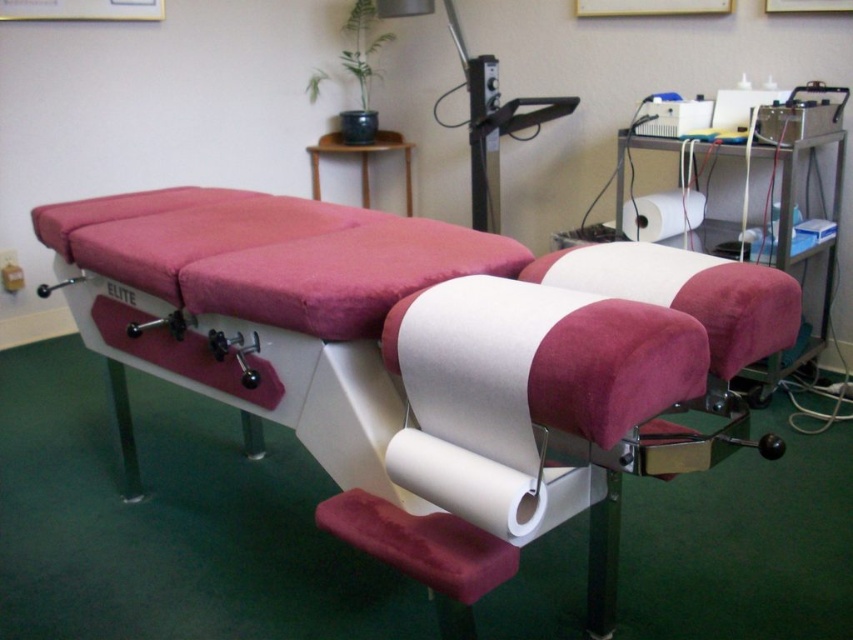
Question: Is white matte toilet paper at lower center thinner than white paper towel at center?

Choices:
 (A) yes
 (B) no

Answer: (B)

Question: Which of these objects is positioned closest to the velvet-like pink hospital bed at center?

Choices:
 (A) velvet-like burgundy stool at lower center
 (B) white matte toilet paper at lower center
 (C) white paper towel at center

Answer: (B)

Question: Which of the following is the farthest from the observer?

Choices:
 (A) white paper towel at center
 (B) velvet-like pink hospital bed at center
 (C) velvet-like burgundy stool at lower center

Answer: (A)

Question: Is velvet-like burgundy stool at lower center thinner than white matte toilet paper at lower center?

Choices:
 (A) no
 (B) yes

Answer: (B)

Question: Which object appears farthest from the camera in this image?

Choices:
 (A) white paper towel at center
 (B) white matte toilet paper at lower center

Answer: (A)

Question: Can you confirm if velvet-like pink hospital bed at center is positioned above white paper towel at center?

Choices:
 (A) no
 (B) yes

Answer: (A)